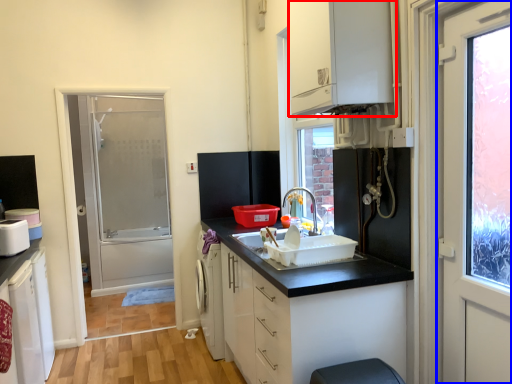
Question: Which object appears closest to the camera in this image, cabinetry (highlighted by a red box) or door (highlighted by a blue box)?

Choices:
 (A) cabinetry
 (B) door

Answer: (B)